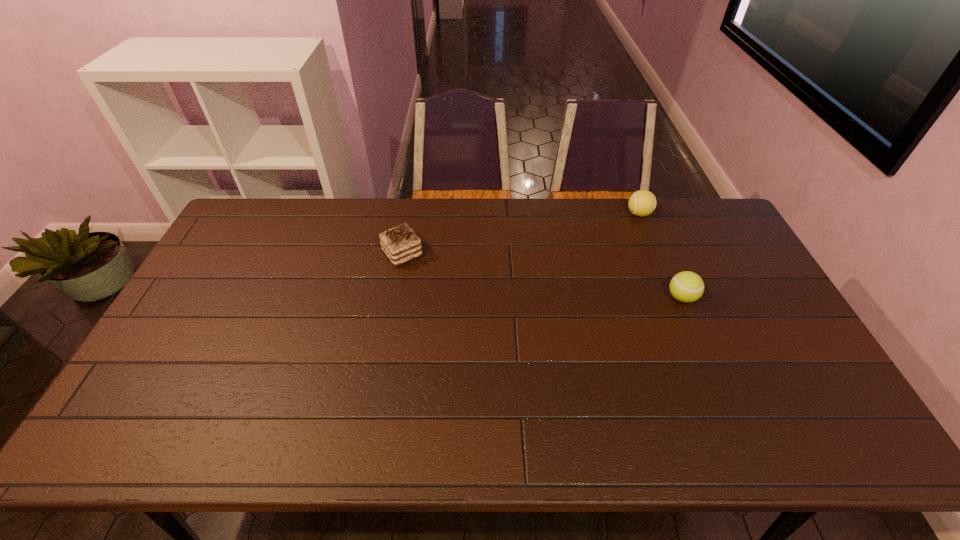
Image resolution: width=960 pixels, height=540 pixels. In order to click on the farther tennis ball in this screenshot , I will do `click(642, 203)`.

The height and width of the screenshot is (540, 960). Identify the location of chocolate cake. (400, 244).

Where is `the second nearest object`? the second nearest object is located at coordinates (400, 244).

At what (x,y) coordinates should I click in order to perform the action: click on the nearer tennis ball. Please return your answer as a coordinate pair (x, y). This screenshot has width=960, height=540. Looking at the image, I should click on (686, 286).

Find the location of a particular element. vacant point located 0.150m on the left of the farthest object is located at coordinates (585, 214).

Locate an element on the screen. Image resolution: width=960 pixels, height=540 pixels. vacant space located 0.150m on the right of the leftmost object is located at coordinates (468, 254).

What are the coordinates of `vacant space located 0.330m on the left of the nearest object` in the screenshot? It's located at (557, 298).

In order to click on tennis ball that is positioned at the far edge in this screenshot , I will do `click(642, 203)`.

You are a GUI agent. You are given a task and a screenshot of the screen. Output one action in this format:
    pyautogui.click(x=<x>, y=<y>)
    Task: Click on the chocolate cake located in the far edge section of the desktop
    
    Given the screenshot: What is the action you would take?
    pyautogui.click(x=400, y=244)

Identify the location of vacant space at the far edge. (423, 240).